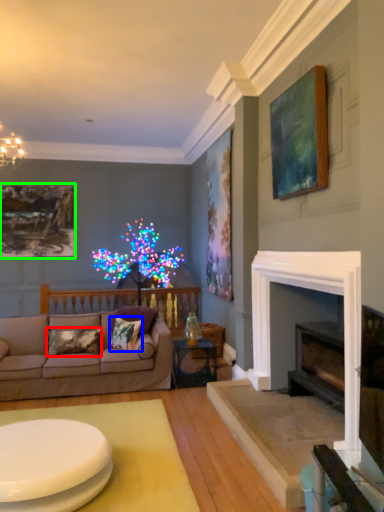
Question: Which object is positioned farthest from pillow (highlighted by a red box)? Select from pillow (highlighted by a blue box) and picture frame (highlighted by a green box).

Choices:
 (A) pillow
 (B) picture frame

Answer: (B)